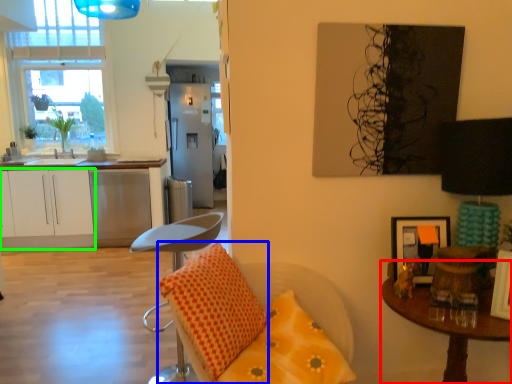
Question: Considering the real-world distances, which object is farthest from table (highlighted by a red box)? pillow (highlighted by a blue box) or cabinetry (highlighted by a green box)?

Choices:
 (A) pillow
 (B) cabinetry

Answer: (B)